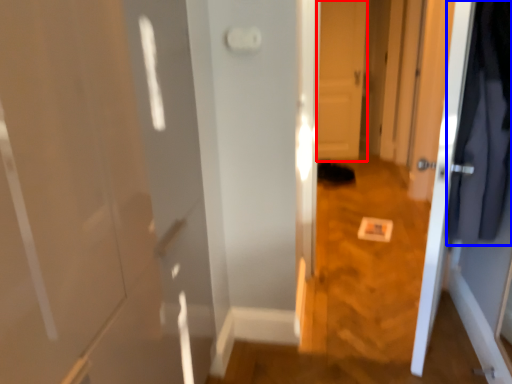
Question: Among these objects, which one is farthest to the camera, door (highlighted by a red box) or clothing (highlighted by a blue box)?

Choices:
 (A) door
 (B) clothing

Answer: (A)